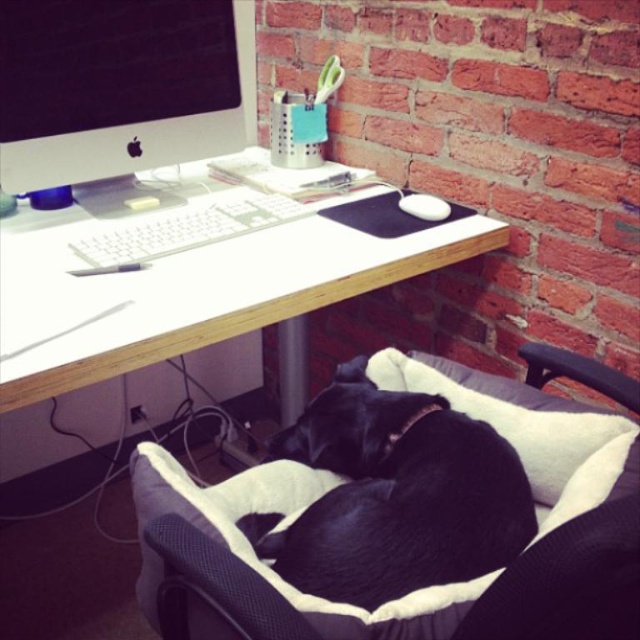
Does black soft dog at lower right appear on the left side of matte black monitor at upper left?

Incorrect, black soft dog at lower right is not on the left side of matte black monitor at upper left.

Is point (372, 572) positioned before point (33, 8)?

Yes, point (372, 572) is in front of point (33, 8).

Does point (504, 552) come in front of point (204, 36)?

That is True.

Locate an element on the screen. This screenshot has width=640, height=640. black soft dog at lower right is located at coordinates (394, 496).

Which is in front, point (145, 328) or point (410, 400)?

Positioned in front is point (145, 328).

Between white wood computer desk at center and black soft dog at lower right, which one is positioned lower?

black soft dog at lower right

The width and height of the screenshot is (640, 640). I want to click on white wood computer desk at center, so click(218, 307).

Does black soft dog at lower right come behind white plastic keyboard at center?

No, black soft dog at lower right is closer to the viewer.

Is point (486, 496) less distant than point (285, 218)?

Yes, it is.

Is point (456, 467) behind point (106, 268)?

No, (456, 467) is closer to viewer.

Identify the location of black soft dog at lower right. (394, 496).